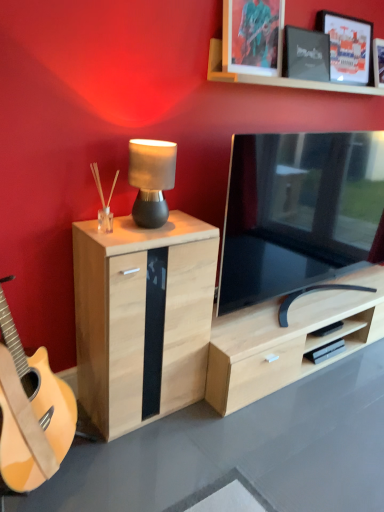
The image size is (384, 512). Find the location of `vacant area located to the right-hand side of natural wood cabinet at left`. vacant area located to the right-hand side of natural wood cabinet at left is located at coordinates (230, 428).